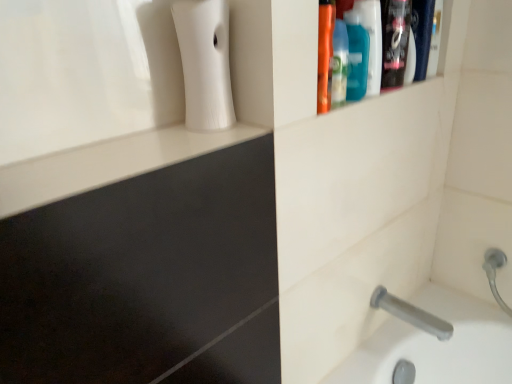
Question: Do you think gray matte tap at lower right is within translucent plastic mouthwash at upper right, the second mouthwash from the right, or outside of it?

Choices:
 (A) outside
 (B) inside

Answer: (A)

Question: From the image's perspective, is gray matte tap at lower right located above or below translucent plastic mouthwash at upper right, the second mouthwash from the right?

Choices:
 (A) above
 (B) below

Answer: (B)

Question: Considering the real-world distances, which object is closest to the translucent plastic mouthwash at upper right, the second mouthwash from the right?

Choices:
 (A) shiny black bottle at upper right
 (B) gray matte tap at lower right
 (C) teal plastic mouthwash at upper right, positioned as the first mouthwash in right-to-left order
 (D) white matte soap dispenser at upper left

Answer: (C)

Question: Which object is positioned closest to the shiny black bottle at upper right?

Choices:
 (A) teal plastic mouthwash at upper right, positioned as the first mouthwash in right-to-left order
 (B) translucent plastic mouthwash at upper right, the second mouthwash from the right
 (C) white matte soap dispenser at upper left
 (D) gray matte tap at lower right

Answer: (A)